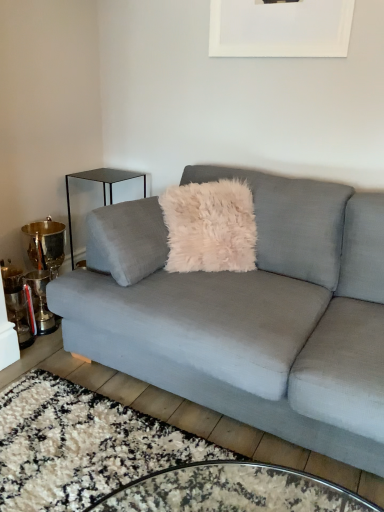
This screenshot has width=384, height=512. Describe the element at coordinates (280, 28) in the screenshot. I see `white matte picture frame at upper center` at that location.

Measure the distance between point (344, 33) and camera.

They are 1.97 meters apart.

Identify the location of velvet gray couch at center. (251, 314).

Between white matte picture frame at upper center and black glass side table at left, which one has smaller width?

With smaller width is white matte picture frame at upper center.

From their relative heights in the image, would you say white matte picture frame at upper center is taller or shorter than black glass side table at left?

Considering their sizes, white matte picture frame at upper center has less height than black glass side table at left.

From a real-world perspective, does white matte picture frame at upper center stand above black glass side table at left?

Yes, from a real-world perspective, white matte picture frame at upper center is over black glass side table at left

Does white matte picture frame at upper center have a smaller size compared to black glass side table at left?

Yes, white matte picture frame at upper center is smaller than black glass side table at left.

How distant is velvet gray couch at center from white matte picture frame at upper center?

velvet gray couch at center is 1.13 meters away from white matte picture frame at upper center.

I want to click on studio couch in front of the white matte picture frame at upper center, so click(x=251, y=314).

Does velvet gray couch at center lie behind white matte picture frame at upper center?

No, velvet gray couch at center is closer to the camera.

Does velvet gray couch at center contain white matte picture frame at upper center?

No, white matte picture frame at upper center is not surrounded by velvet gray couch at center.

This screenshot has height=512, width=384. Identify the location of table that is on the left side of velvet gray couch at center. (103, 188).

Is velvet gray couch at center wider than black glass side table at left?

Yes.

Which object is more forward, velvet gray couch at center or black glass side table at left?

velvet gray couch at center.

From a real-world perspective, is black glass side table at left positioned above or below velvet gray couch at center?

A: black glass side table at left is situated lower than velvet gray couch at center in the real world.

Between black glass side table at left and velvet gray couch at center, which one has smaller width?

Thinner between the two is black glass side table at left.

Can you confirm if black glass side table at left is smaller than velvet gray couch at center?

Yes.

Is velvet gray couch at center a part of black glass side table at left?

Definitely not — velvet gray couch at center is not inside black glass side table at left.

Is white matte picture frame at upper center inside black glass side table at left?

That's incorrect, white matte picture frame at upper center is not inside black glass side table at left.

From a real-world perspective, is black glass side table at left positioned over white matte picture frame at upper center based on gravity?

No.

Is white matte picture frame at upper center at the back of black glass side table at left?

black glass side table at left is not turned away from white matte picture frame at upper center.

Considering their positions, is white matte picture frame at upper center located in front of or behind velvet gray couch at center?

white matte picture frame at upper center is positioned farther from the viewer than velvet gray couch at center.

Measure the distance from white matte picture frame at upper center to velvet gray couch at center.

white matte picture frame at upper center is 1.13 meters away from velvet gray couch at center.

Considering the sizes of white matte picture frame at upper center and velvet gray couch at center in the image, is white matte picture frame at upper center bigger or smaller than velvet gray couch at center?

Considering their sizes, white matte picture frame at upper center takes up less space than velvet gray couch at center.

From a real-world perspective, who is located lower, white matte picture frame at upper center or velvet gray couch at center?

velvet gray couch at center.

Identify the location of table that is behind the white matte picture frame at upper center. This screenshot has height=512, width=384. (103, 188).

Locate an element on the screen. The width and height of the screenshot is (384, 512). picture frame on the right of velvet gray couch at center is located at coordinates (280, 28).

Considering their positions, is white matte picture frame at upper center positioned closer to velvet gray couch at center than black glass side table at left?

Based on the image, white matte picture frame at upper center appears to be nearer to velvet gray couch at center.

Which object lies nearer to the anchor point velvet gray couch at center, black glass side table at left or white matte picture frame at upper center?

white matte picture frame at upper center lies closer to velvet gray couch at center than the other object.

When comparing their distances from white matte picture frame at upper center, does velvet gray couch at center or black glass side table at left seem closer?

Among the two, velvet gray couch at center is located nearer to white matte picture frame at upper center.

When comparing their distances from black glass side table at left, does white matte picture frame at upper center or velvet gray couch at center seem closer?

The object closer to black glass side table at left is white matte picture frame at upper center.

From the image, which object appears to be farther from black glass side table at left, velvet gray couch at center or white matte picture frame at upper center?

velvet gray couch at center is further to black glass side table at left.

From the image, which object appears to be nearer to white matte picture frame at upper center, black glass side table at left or velvet gray couch at center?

velvet gray couch at center is positioned closer to the anchor white matte picture frame at upper center.

Where is `picture frame between velvet gray couch at center and black glass side table at left from front to back`? picture frame between velvet gray couch at center and black glass side table at left from front to back is located at coordinates (280, 28).